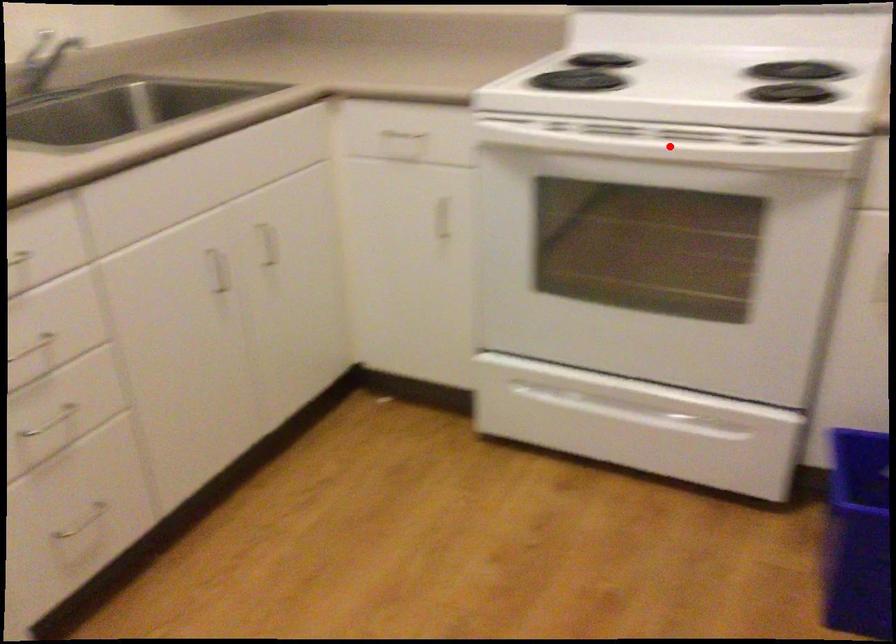
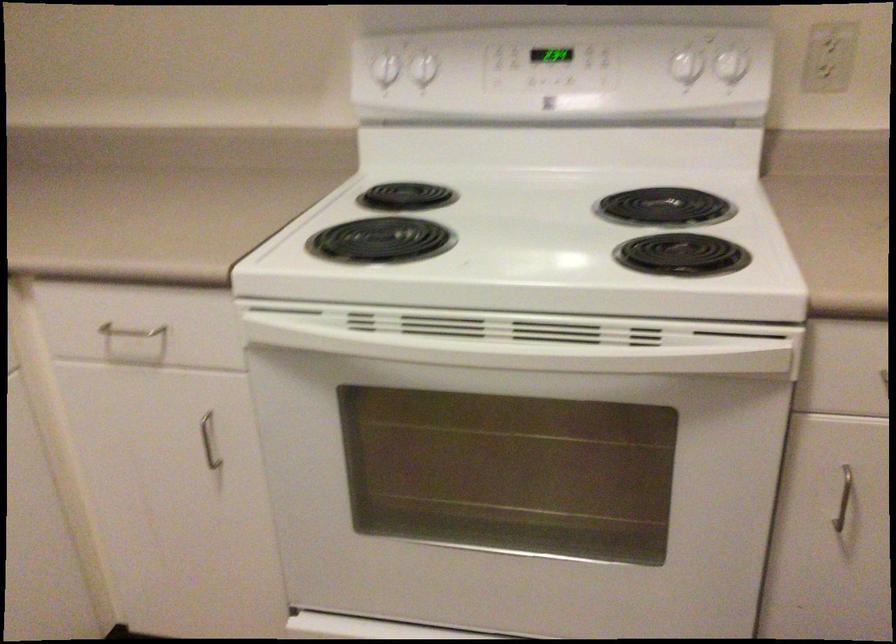
Question: A red point is marked in image1. In image2, is the corresponding 3D point closer to the camera or farther? Reply with the corresponding letter.

Choices:
 (A) The corresponding 3D point is closer.
 (B) The corresponding 3D point is farther.

Answer: (A)